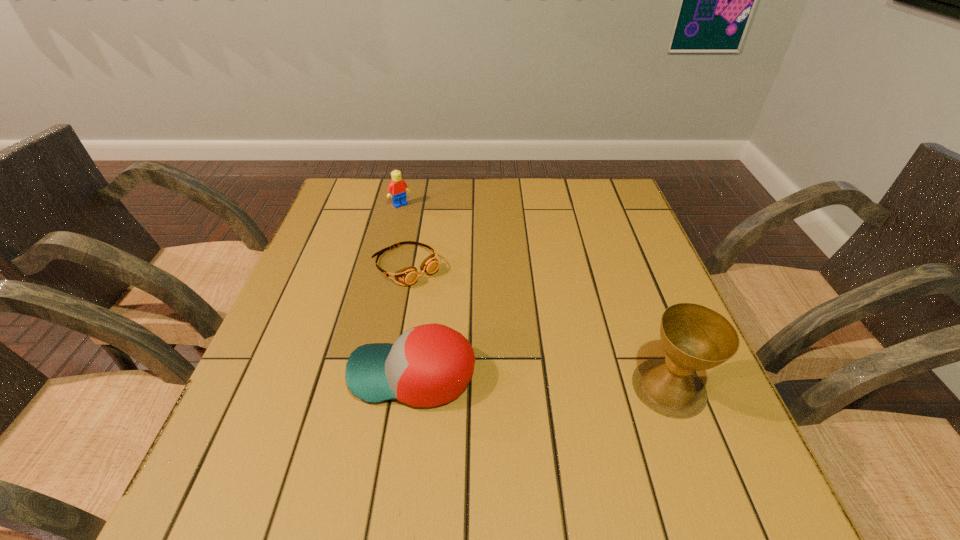
Locate an element on the screen. This screenshot has height=540, width=960. baseball cap is located at coordinates (429, 365).

The image size is (960, 540). What are the coordinates of `the rightmost object` in the screenshot? It's located at (694, 337).

I want to click on chalice, so click(694, 337).

The height and width of the screenshot is (540, 960). In order to click on the farthest object in this screenshot , I will do `click(397, 189)`.

At what (x,y) coordinates should I click in order to perform the action: click on the shortest object. Please return your answer as a coordinate pair (x, y). The width and height of the screenshot is (960, 540). Looking at the image, I should click on (409, 275).

Locate an element on the screen. The height and width of the screenshot is (540, 960). the third nearest object is located at coordinates (409, 275).

Identify the location of vacant space situated 0.050m at the brim of the baseball cap. The width and height of the screenshot is (960, 540). (324, 375).

Image resolution: width=960 pixels, height=540 pixels. I want to click on free space located at the brim of the baseball cap, so click(x=273, y=375).

Locate an element on the screen. free location located 0.150m at the brim of the baseball cap is located at coordinates (273, 375).

Where is `vacant space situated on the left of the rightmost object`? The width and height of the screenshot is (960, 540). vacant space situated on the left of the rightmost object is located at coordinates (507, 387).